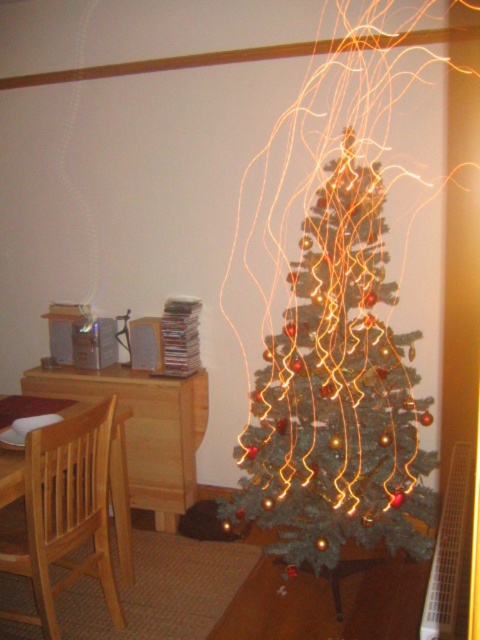
Can you confirm if green matte christmas tree at center is positioned to the right of light brown wooden chair at left?

Yes, green matte christmas tree at center is to the right of light brown wooden chair at left.

Is green matte christmas tree at center in front of light brown wooden chair at left?

No, it is not.

Locate an element on the screen. The width and height of the screenshot is (480, 640). green matte christmas tree at center is located at coordinates (337, 394).

In the scene shown: Who is more forward, (x=388, y=435) or (x=87, y=378)?

Point (x=388, y=435) is in front.

Is point (227, 518) farther from viewer compared to point (169, 484)?

That is False.

The image size is (480, 640). I want to click on green matte christmas tree at center, so click(337, 394).

At what (x,y) coordinates should I click in order to perform the action: click on green matte christmas tree at center. Please return your answer as a coordinate pair (x, y). Looking at the image, I should click on point(337,394).

Does point (31, 499) lie behind point (189, 401)?

No, it is in front of (189, 401).

Is light brown wooden chair at left to the right of light wood table at left from the viewer's perspective?

Incorrect, light brown wooden chair at left is not on the right side of light wood table at left.

Which is in front, point (58, 538) or point (162, 460)?

Point (58, 538)

You are a GUI agent. You are given a task and a screenshot of the screen. Output one action in this format:
    pyautogui.click(x=<x>, y=<y>)
    Task: Click on the light brown wooden chair at left
    Image resolution: width=480 pixels, height=640 pixels.
    Given the screenshot: What is the action you would take?
    pyautogui.click(x=63, y=513)